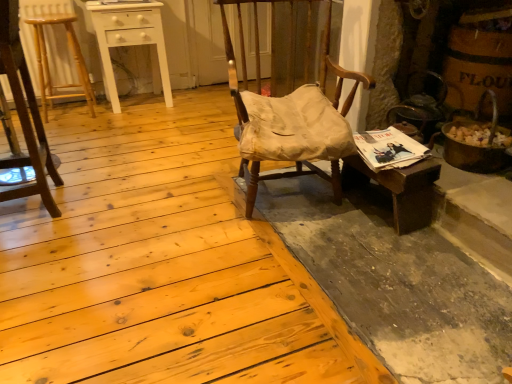
Where is `vacant space in between wooden stool at left, the first chair in the left-to-right sequence, and white wood table at upper left`? vacant space in between wooden stool at left, the first chair in the left-to-right sequence, and white wood table at upper left is located at coordinates (106, 142).